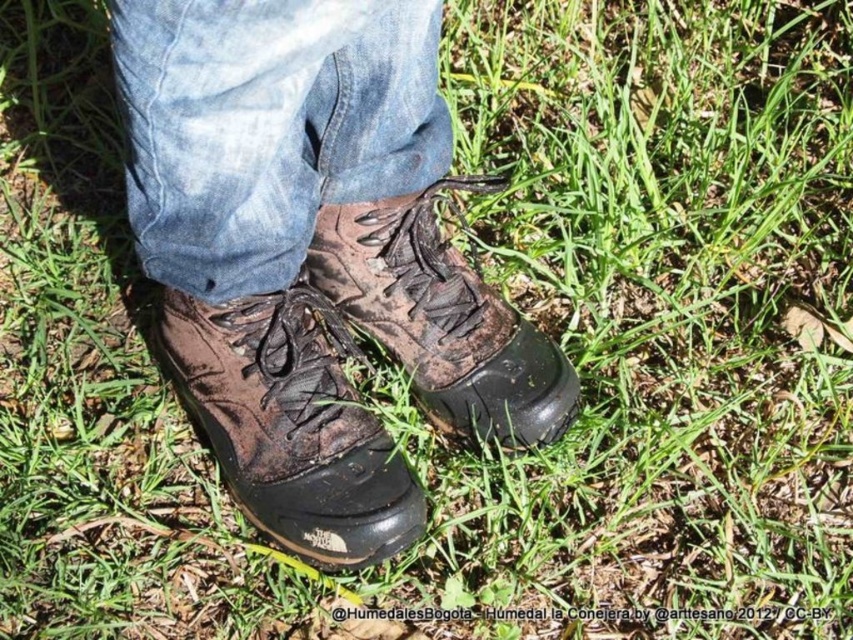
Looking at this image, you are trying to determine if the denim at center is covering the brown leather boot at center. Based on the scene, can you confirm this?

The denim at center is positioned over brown leather boot at center, so yes, the denim at center is covering the brown leather boot at center.

You are standing in a park and see two points marked on the ground. The first point is at coordinates point (x=403, y=177) and the second is at point (x=519, y=372). If you are facing north, which point is closer to you?

Point (x=403, y=177) is in front of point (x=519, y=372), so if you are facing north, point (x=403, y=177) is closer to you.

You are a photographer trying to capture the texture details of the denim at center and the brown suede boot at center. Since you want to focus on the denim first, which object should you adjust your camera focus on first and why?

The denim at center is located above the brown suede boot at center, so you should focus on the denim at center first as it is closer to the camera.